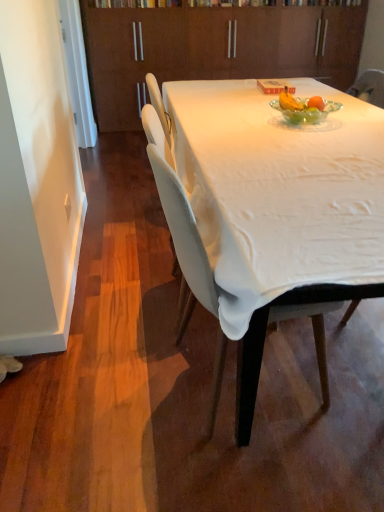
Question: Considering the positions of point (183, 326) and point (329, 61), is point (183, 326) closer or farther from the camera than point (329, 61)?

Choices:
 (A) farther
 (B) closer

Answer: (B)

Question: Is white fabric chair at center bigger or smaller than brown wood cabinetry at upper center?

Choices:
 (A) small
 (B) big

Answer: (A)

Question: Which object is the closest to the white cloth-covered table at center?

Choices:
 (A) white fabric chair at center
 (B) brown wood cabinetry at upper center

Answer: (A)

Question: Which object is the closest to the brown wood cabinetry at upper center?

Choices:
 (A) white fabric chair at center
 (B) white cloth-covered table at center

Answer: (B)